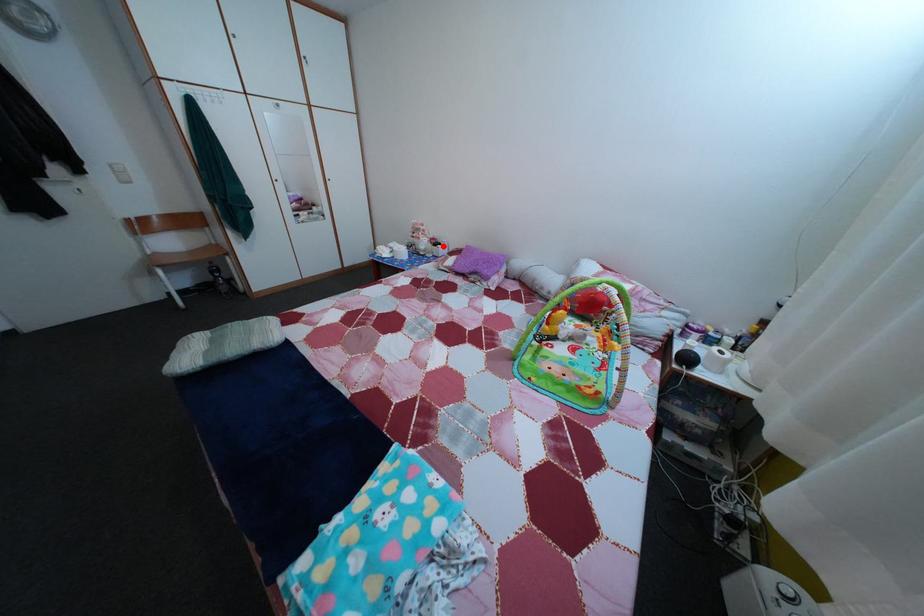
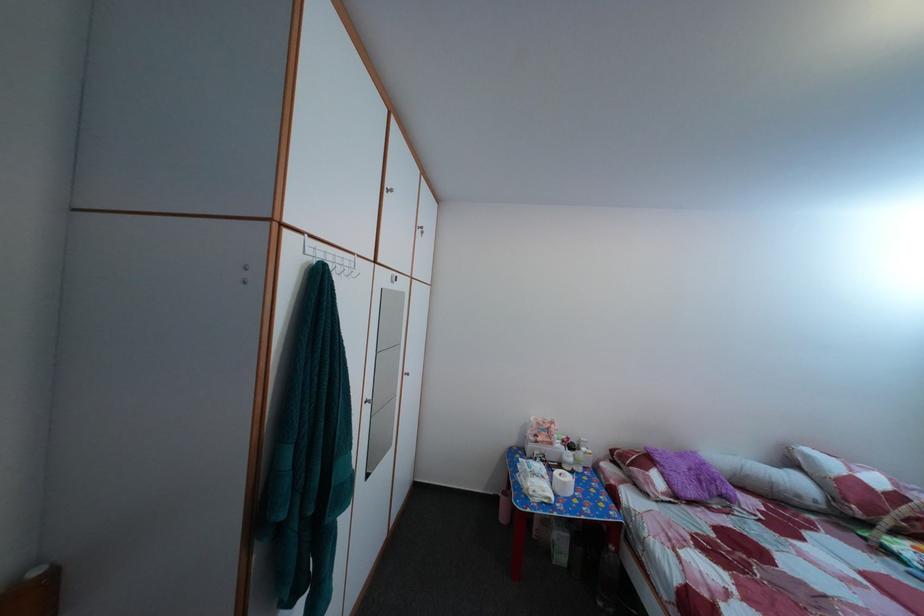
Question: I am providing you with two images of the same scene from different viewpoints. Given a red point in image1, look at the same physical point in image2. Is it:

Choices:
 (A) Closer to the viewpoint
 (B) Farther from the viewpoint

Answer: (B)